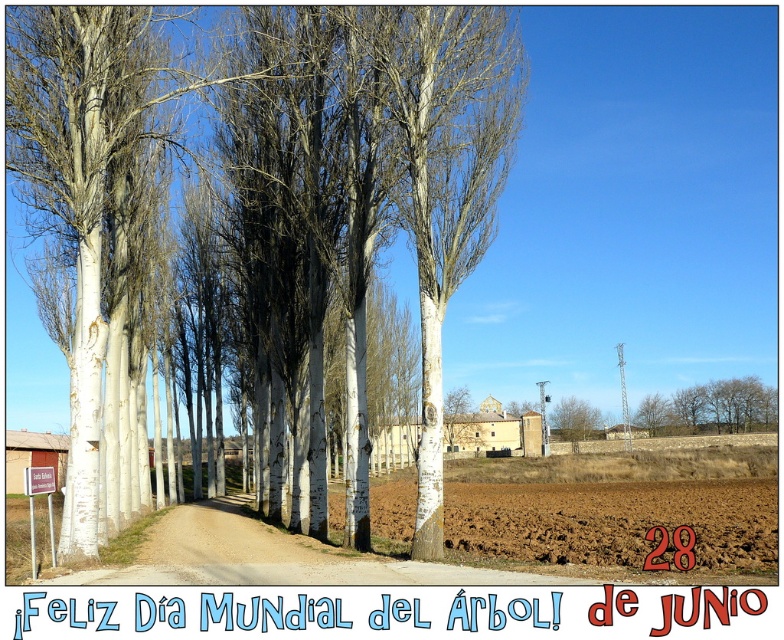
You are standing at the point marked as point (445, 176) in the image. What object is located exactly at that point?

The white smooth birch tree at center is located exactly at point (445, 176).

You are standing at the entrance of the dirt path and want to walk towards the white smooth birch tree at center. Which direction should you head?

The white smooth birch tree at center is located at point (445, 176), so you should head towards the center of the image to reach it.